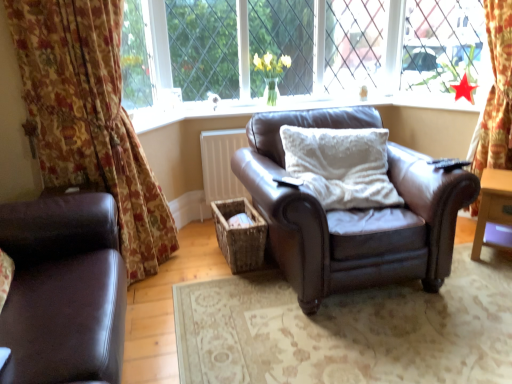
Question: Is woven brown basket at center touching wooden side table at right?

Choices:
 (A) yes
 (B) no

Answer: (B)

Question: Does woven brown basket at center appear on the left side of wooden side table at right?

Choices:
 (A) no
 (B) yes

Answer: (B)

Question: From a real-world perspective, is woven brown basket at center on wooden side table at right?

Choices:
 (A) yes
 (B) no

Answer: (B)

Question: From the image's perspective, is woven brown basket at center over wooden side table at right?

Choices:
 (A) no
 (B) yes

Answer: (A)

Question: Is woven brown basket at center not inside wooden side table at right?

Choices:
 (A) yes
 (B) no

Answer: (A)

Question: Does point (373, 210) appear closer or farther from the camera than point (207, 117)?

Choices:
 (A) farther
 (B) closer

Answer: (B)

Question: Relative to matte brown leather armchair at center, is brown leather chair at center in front or behind?

Choices:
 (A) front
 (B) behind

Answer: (A)

Question: Is brown leather chair at center taller or shorter than matte brown leather armchair at center?

Choices:
 (A) tall
 (B) short

Answer: (A)

Question: From a real-world perspective, relative to matte brown leather armchair at center, is brown leather chair at center vertically above or below?

Choices:
 (A) below
 (B) above

Answer: (A)

Question: Relative to clear glass window at center, is wooden side table at right in front or behind?

Choices:
 (A) behind
 (B) front

Answer: (B)

Question: Is point (494, 178) positioned closer to the camera than point (444, 16)?

Choices:
 (A) closer
 (B) farther

Answer: (A)

Question: Is wooden side table at right situated inside clear glass window at center or outside?

Choices:
 (A) inside
 (B) outside

Answer: (B)

Question: From the image's perspective, is wooden side table at right above or below clear glass window at center?

Choices:
 (A) below
 (B) above

Answer: (A)

Question: Which is correct: floral fabric curtain at left is inside matte brown leather armchair at center, or outside of it?

Choices:
 (A) outside
 (B) inside

Answer: (A)

Question: From the image's perspective, relative to matte brown leather armchair at center, is floral fabric curtain at left above or below?

Choices:
 (A) above
 (B) below

Answer: (B)